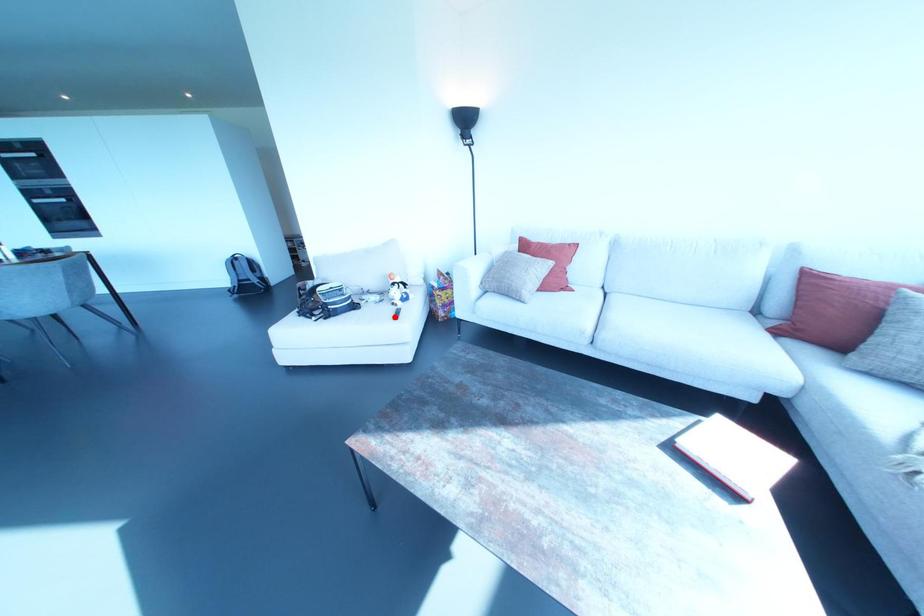
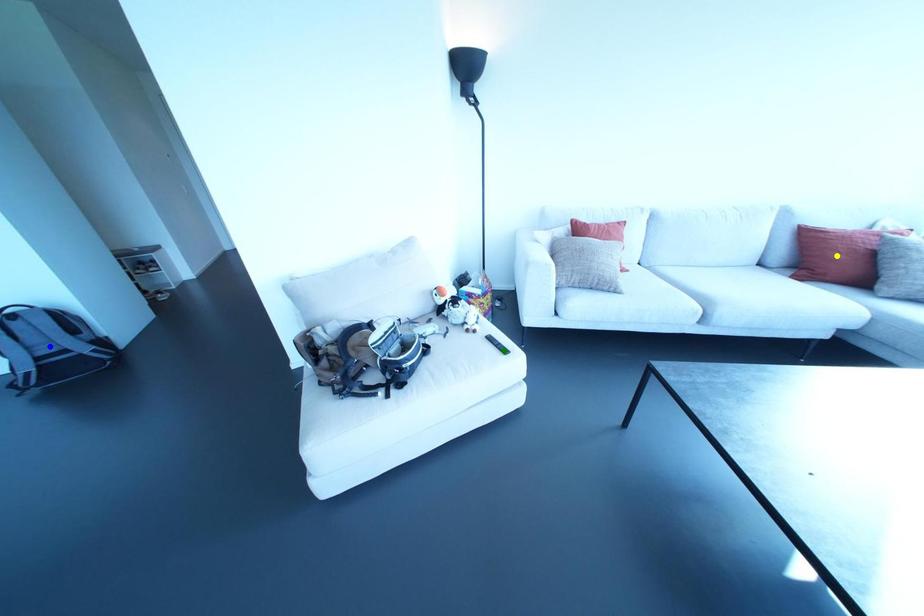
Question: I am providing you with two images of the same scene from different viewpoints. A red point is marked on the first image. You are given multiple points on the second image. In image 2, which mark is for the same physical point as the one in image 1?

Choices:
 (A) yellow point
 (B) green point
 (C) blue point

Answer: (B)